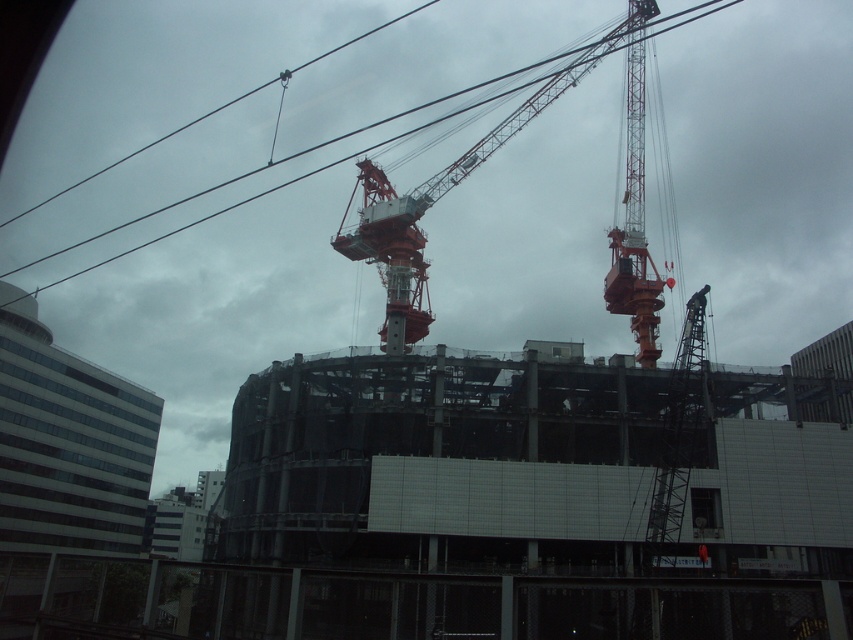
You are a safety inspector at the construction site. You need to ensure that the metallic red crane at upper right maintains a safe distance from the metallic wire at upper center to avoid collision. According to safety regulations, the minimum safe distance required is 35 meters. Can the crane operate safely at its current position?

The metallic red crane at upper right is 36.10 meters away from the metallic wire at upper center. Since this distance exceeds the required 35 meters, the crane can operate safely at its current position without violating the safety regulations.

Consider the image. You are a surveyor standing at the camera position. You need to measure the distance between the metallic red crane at upper right and the nearest edge of the glass railing in the foreground. Can you determine if the distance is more than 300 feet?

The distance between the metallic red crane at upper right and the camera is 379.07 feet. Since the glass railing is in the foreground, it is closer to the camera than the crane. Therefore, the distance between the metallic red crane at upper right and the nearest edge of the glass railing in the foreground is greater than 300 feet.

You are a construction worker standing at point (393, 307). You need to retrieve a tool from your truck parked at the construction site. The truck is located 100 meters away from your current position. Can you safely walk directly to the truck without any obstacles?

The distance between you at point (393, 307) and the camera is 107.58 meters. Since the truck is only 100 meters away, it is closer than the camera. However, the scene description mentions cranes, scaffolding, and an unfinished building, which may block your path. Without specific information about the path, it is uncertain if there are obstacles. You should check for any potential obstructions before proceeding.